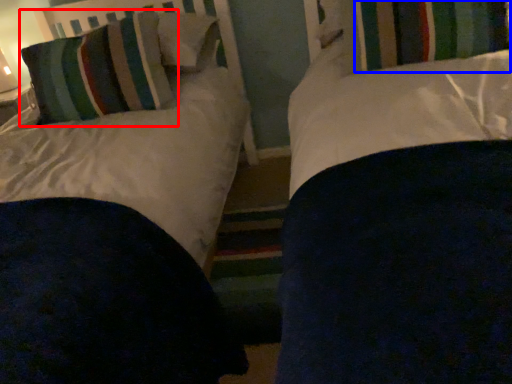
Question: Which object is closer to the camera taking this photo, pillow (highlighted by a red box) or curtain (highlighted by a blue box)?

Choices:
 (A) pillow
 (B) curtain

Answer: (B)